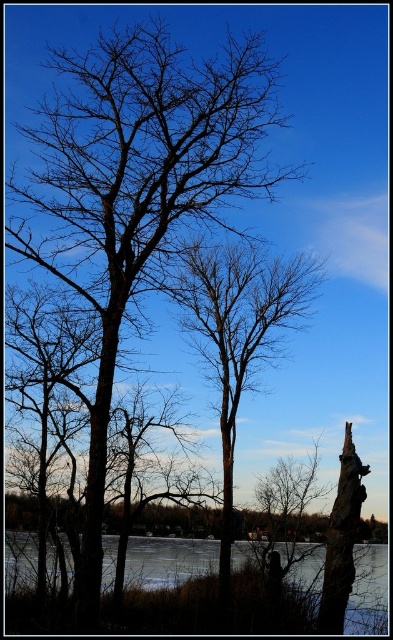
You are a hiker who wants to cross the frozen ice at lower center. You have a 5 meter long rope. Can you use the rope to tie yourself to the brown rough bark tree at center for safety?

The brown rough bark tree at center is 4.80 meters from frozen ice at lower center. Since the rope is 5 meters long, it is long enough to tie yourself to the tree while crossing the ice.

You are an artist planning to paint the winter scene. You need to decide which object to paint first based on their sizes. Which object should you start with, the brown rough bark tree at center or the frozen ice at lower center?

The brown rough bark tree at center is much taller than the frozen ice at lower center, so you should start with the brown rough bark tree at center as it is larger and likely requires more detailed work.

You are an ice safety inspector checking the thickness of the frozen ice at lower center and the smooth bark tree trunk at right. Which object has a greater thickness?

The smooth bark tree trunk at right has a greater thickness than the frozen ice at lower center.